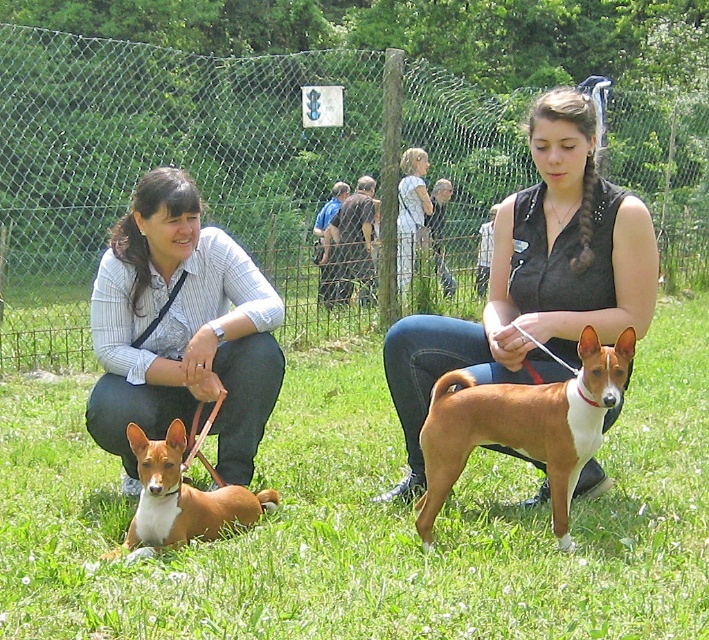
Is matte black shirt at left wider than brown smooth dog at lower left?

Yes.

Describe the element at coordinates (179, 330) in the screenshot. The height and width of the screenshot is (640, 709). I see `matte black shirt at left` at that location.

The height and width of the screenshot is (640, 709). In order to click on matte black shirt at left in this screenshot , I will do `click(179, 330)`.

Between black sleeveless top at center and brown smooth dog at lower left, which one is positioned lower?

brown smooth dog at lower left is lower down.

Is black sleeveless top at center positioned at the back of brown smooth dog at lower left?

Yes.

Is point (413, 452) closer to camera compared to point (223, 513)?

No.

This screenshot has width=709, height=640. What are the coordinates of `black sleeveless top at center` in the screenshot? It's located at (535, 278).

This screenshot has height=640, width=709. What do you see at coordinates (369, 520) in the screenshot?
I see `green grass at lower center` at bounding box center [369, 520].

Which is below, green grass at lower center or brown smooth dog at lower left?

green grass at lower center is below.

Between point (703, 598) and point (143, 541), which one is positioned in front?

Point (703, 598) is more forward.

Identify the location of green grass at lower center. Image resolution: width=709 pixels, height=640 pixels. (369, 520).